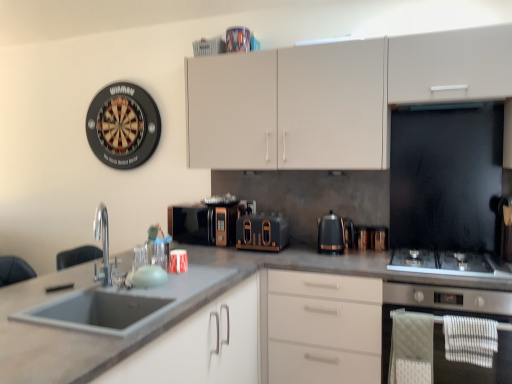
The height and width of the screenshot is (384, 512). Identify the location of vacant area that is situated to the right of metallic silver kettle at center, which is the first appliance from right to left. (397, 245).